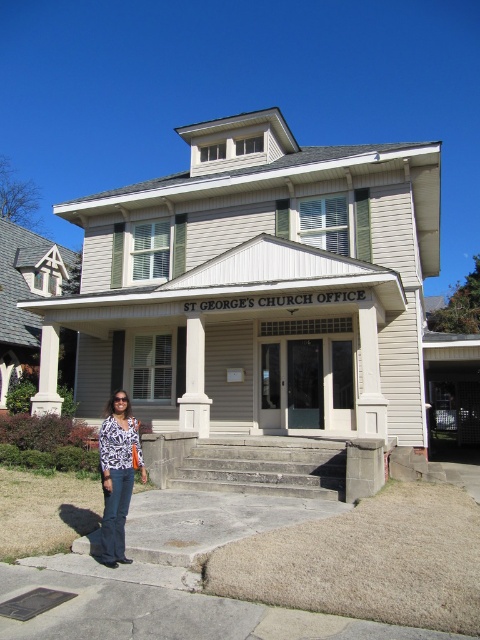
Which of these two, gray concrete stairs at center or white smooth column at left, stands taller?

With more height is white smooth column at left.

Who is positioned more to the right, gray concrete stairs at center or white smooth column at left?

Positioned to the right is gray concrete stairs at center.

You are a GUI agent. You are given a task and a screenshot of the screen. Output one action in this format:
    pyautogui.click(x=<x>, y=<y>)
    Task: Click on the gray concrete stairs at center
    This screenshot has width=480, height=640.
    Given the screenshot: What is the action you would take?
    pyautogui.click(x=264, y=467)

In the scene shown: Who is higher up, printed fabric blouse at lower left or white smooth column at left?

white smooth column at left is above.

Is printed fabric blouse at lower left below white smooth column at left?

Yes.

At what (x,y) coordinates should I click in order to perform the action: click on printed fabric blouse at lower left. Please return your answer as a coordinate pair (x, y). Looking at the image, I should click on (118, 474).

In the scene shown: Does gray concrete stairs at center appear on the right side of printed fabric blouse at lower left?

Correct, you'll find gray concrete stairs at center to the right of printed fabric blouse at lower left.

Between gray concrete stairs at center and printed fabric blouse at lower left, which one appears on the left side from the viewer's perspective?

Positioned to the left is printed fabric blouse at lower left.

Describe the element at coordinates (264, 467) in the screenshot. I see `gray concrete stairs at center` at that location.

Where is `gray concrete stairs at center`? Image resolution: width=480 pixels, height=640 pixels. gray concrete stairs at center is located at coordinates (264, 467).